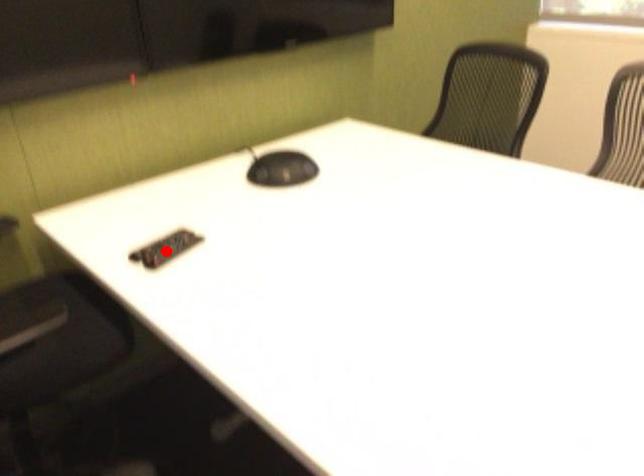
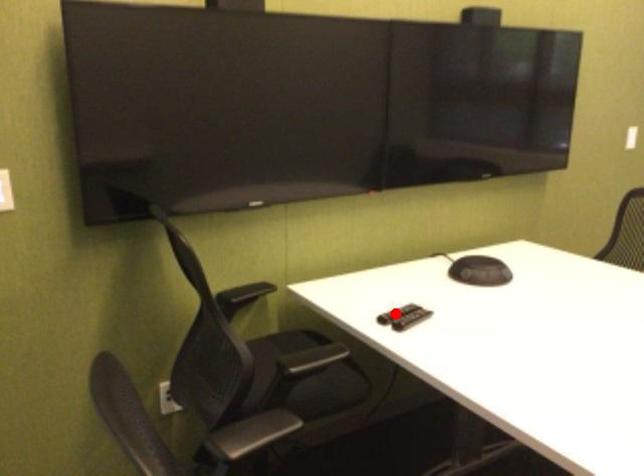
I am providing you with two images of the same scene from different viewpoints. A red point is marked on the first image and another point is marked on the second image. Does the point marked in image1 correspond to the same location as the one in image2?

No